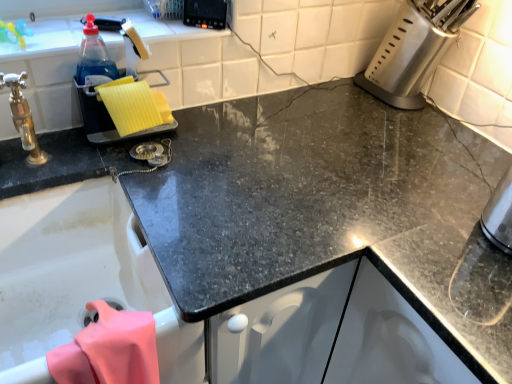
You are a GUI agent. You are given a task and a screenshot of the screen. Output one action in this format:
    pyautogui.click(x=<x>, y=<y>)
    Task: Click on the vacant space situated on the left part of yellow sponge at left, marked as the third appliance in a right-to-left arrangement
    Image resolution: width=512 pixels, height=384 pixels.
    Given the screenshot: What is the action you would take?
    pyautogui.click(x=51, y=143)